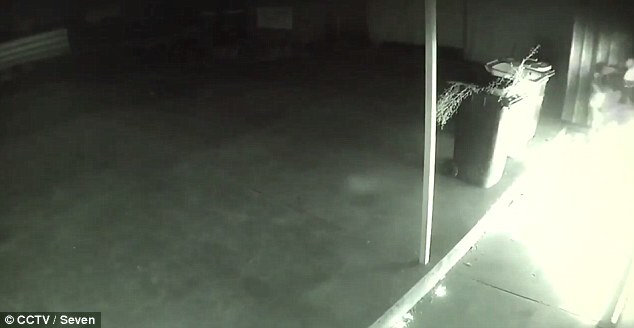
You are a GUI agent. You are given a task and a screenshot of the screen. Output one action in this format:
    pyautogui.click(x=<x>, y=<y>)
    Task: Click on the trash
    The width and height of the screenshot is (634, 328).
    Given the screenshot: What is the action you would take?
    pyautogui.click(x=489, y=116)